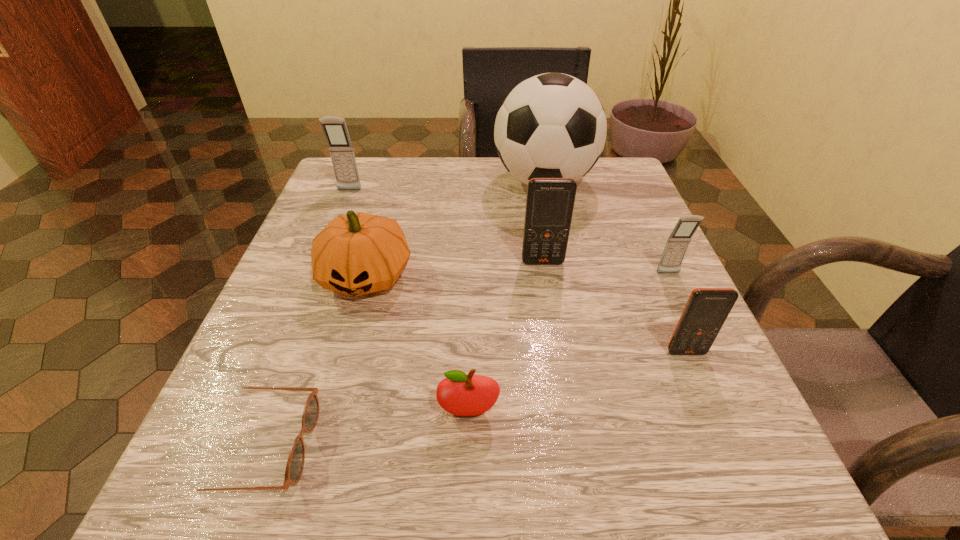
Choose which object is the sixth nearest neighbor to the brown sunglasses. Please provide its 2D coordinates. Your answer should be formatted as a tuple, i.e. [(x, y)], where the tuple contains the x and y coordinates of a point satisfying the conditions above.

[(335, 130)]

Locate which cellular telephone ranks third in proximity to the farther gray cellular telephone. Please provide its 2D coordinates. Your answer should be formatted as a tuple, i.e. [(x, y)], where the tuple contains the x and y coordinates of a point satisfying the conditions above.

[(706, 310)]

Identify which cellular telephone is the second closest to the nearer gray cellular telephone. Please provide its 2D coordinates. Your answer should be formatted as a tuple, i.e. [(x, y)], where the tuple contains the x and y coordinates of a point satisfying the conditions above.

[(550, 201)]

This screenshot has height=540, width=960. Find the location of `vacant area that satisfies the following two spatial constraints: 1. on the side of the apple with the carved face; 2. on the left side of the orange gourd`. vacant area that satisfies the following two spatial constraints: 1. on the side of the apple with the carved face; 2. on the left side of the orange gourd is located at coordinates (328, 412).

Find the location of a particular element. This screenshot has height=540, width=960. blank area in the image that satisfies the following two spatial constraints: 1. on the front-facing side of the second nearest cellular telephone; 2. on the front-facing side of the sunglasses is located at coordinates (748, 446).

Where is `vacant space that satisfies the following two spatial constraints: 1. on the side of the orange gourd with the carved face; 2. on the front-facing side of the shortest object`? vacant space that satisfies the following two spatial constraints: 1. on the side of the orange gourd with the carved face; 2. on the front-facing side of the shortest object is located at coordinates (319, 446).